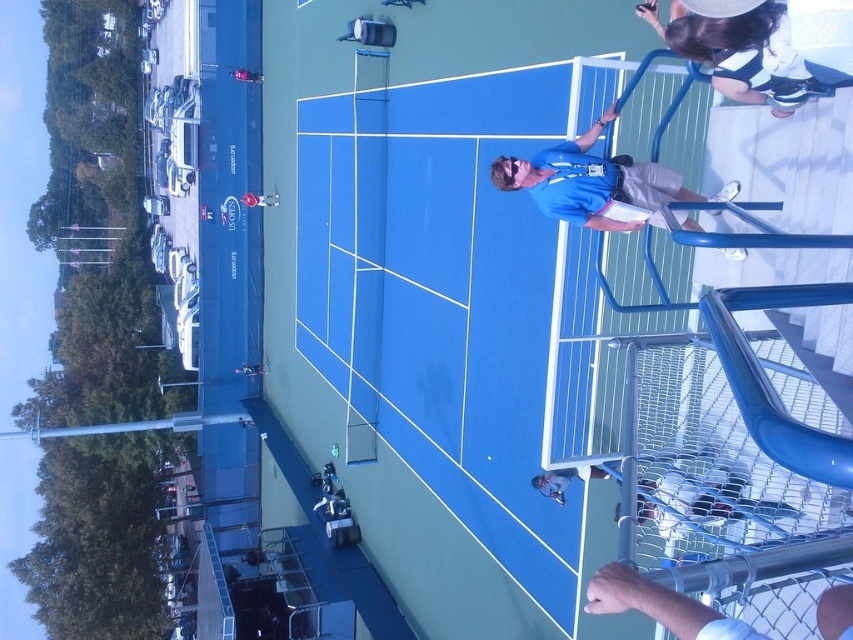
Is white cotton shirt at upper right bigger than metallic silver tennis racket at center?

Correct, white cotton shirt at upper right is larger in size than metallic silver tennis racket at center.

How much distance is there between white cotton shirt at upper right and metallic silver tennis racket at center?

They are 82.24 feet apart.

Identify the location of white cotton shirt at upper right. The image size is (853, 640). (746, 54).

Between blue fabric shirt at upper center and metallic silver pole at lower right, which one has less height?

With less height is metallic silver pole at lower right.

Can you confirm if blue fabric shirt at upper center is positioned to the right of metallic silver pole at lower right?

Yes, blue fabric shirt at upper center is to the right of metallic silver pole at lower right.

Identify the location of blue fabric shirt at upper center. pos(593,182).

Which of these two, blue fabric shirt at upper center or white fabric tennis racket at center, stands taller?

blue fabric shirt at upper center is taller.

Where is `blue fabric shirt at upper center`? The height and width of the screenshot is (640, 853). blue fabric shirt at upper center is located at coordinates (593, 182).

This screenshot has height=640, width=853. I want to click on blue fabric shirt at upper center, so click(593, 182).